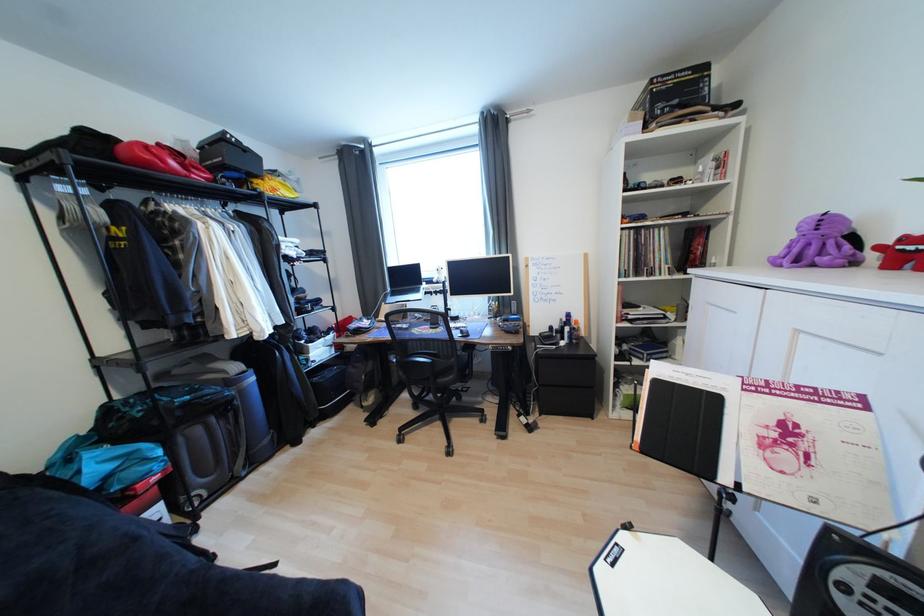
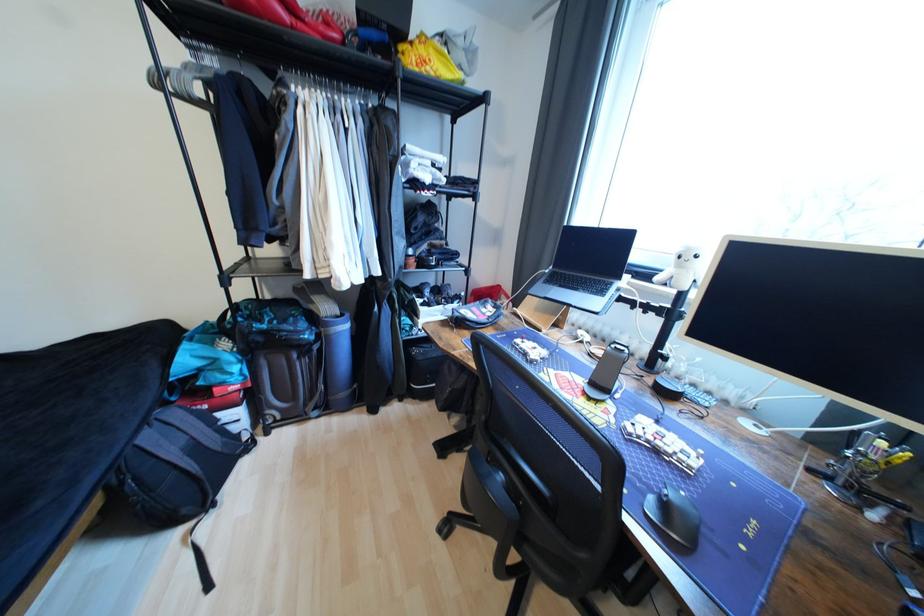
Find the pixel in the second image that matches point 441,282 in the first image.

(663, 280)